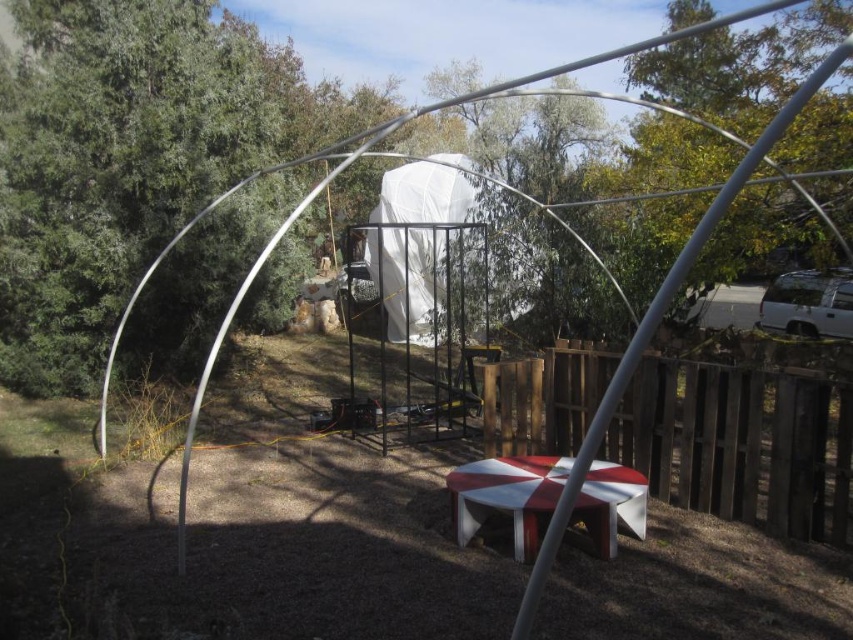
You are setting up a temporary workspace in the outdoor scene. You have a wooden object and a white fabric tent. To ensure stability, you need to place the wooden object to the right of the tent. Is the current placement of the wooden at right and white fabric tent at center correct?

Yes, the wooden at right is already positioned on the right side of the white fabric tent at center, so the current placement meets the requirement.

You are a contractor assessing the construction site. You see the wooden at right and the white fabric tent at center. Which object takes up more space in the scene?

The wooden at right is larger in size than the white fabric tent at center, so it takes up more space in the scene.

You are a construction worker standing near the wooden at right and the white glossy picnic table at center. Which object is closer to you?

The wooden at right is closer to you since it is further to the viewer than the white glossy picnic table at center.